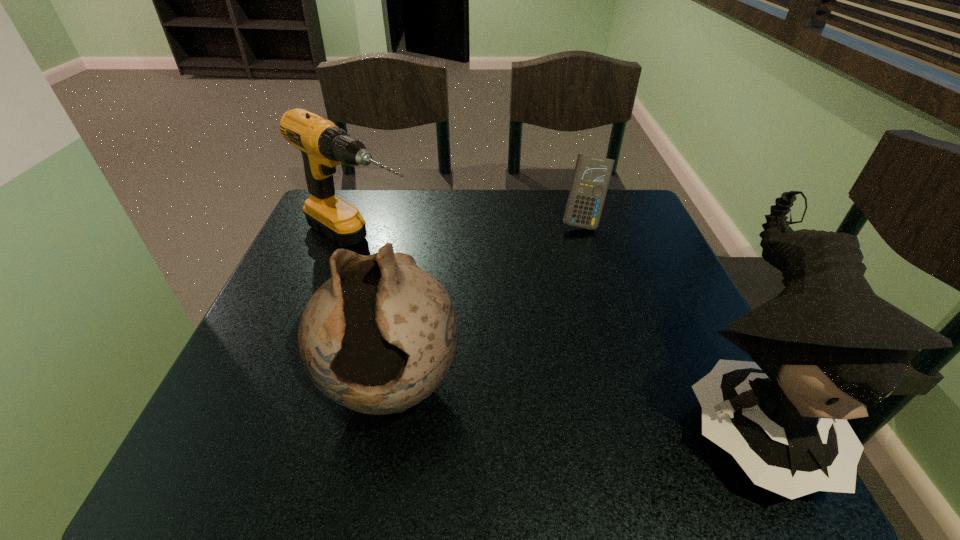
Locate an element on the screen. This screenshot has height=540, width=960. vacant space at the far edge of the desktop is located at coordinates (461, 235).

You are a GUI agent. You are given a task and a screenshot of the screen. Output one action in this format:
    pyautogui.click(x=<x>, y=<y>)
    Task: Click on the free space at the left edge
    The image size is (960, 540).
    Given the screenshot: What is the action you would take?
    pyautogui.click(x=311, y=260)

Locate an element on the screen. This screenshot has height=540, width=960. free region at the right edge is located at coordinates (693, 314).

The image size is (960, 540). In the image, there is a desktop. Identify the location of free space at the far left corner. [x=353, y=192].

Locate an element on the screen. This screenshot has width=960, height=540. vacant space at the near left corner of the desktop is located at coordinates (276, 383).

Where is `free space between the pottery and the shortest object`? free space between the pottery and the shortest object is located at coordinates (488, 305).

Image resolution: width=960 pixels, height=540 pixels. Find the location of `vacant region between the calculator and the doll`. vacant region between the calculator and the doll is located at coordinates (664, 318).

Find the location of a particular element. Image resolution: width=960 pixels, height=540 pixels. empty space between the drill and the doll is located at coordinates (553, 329).

Find the location of `vacant region between the doll and the pottery`. vacant region between the doll and the pottery is located at coordinates (569, 401).

Find the location of a particular element. This screenshot has width=960, height=540. empty location between the shortest object and the drill is located at coordinates (471, 234).